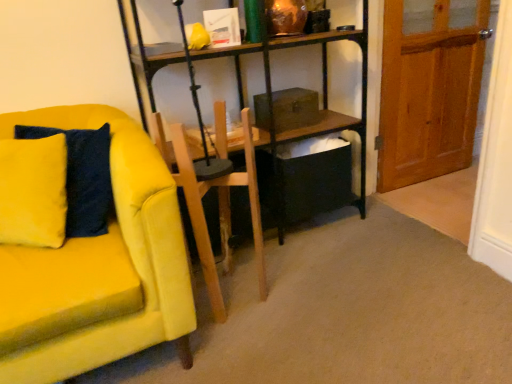
Locate an element on the screen. The width and height of the screenshot is (512, 384). free space below wooden armchair at center (from a real-world perspective) is located at coordinates (233, 289).